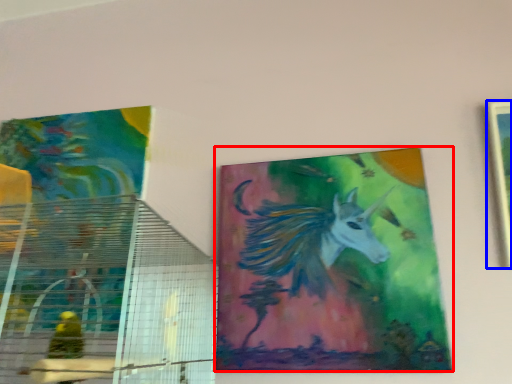
Question: Which object appears closest to the camera in this image, picture frame (highlighted by a red box) or picture frame (highlighted by a blue box)?

Choices:
 (A) picture frame
 (B) picture frame

Answer: (B)